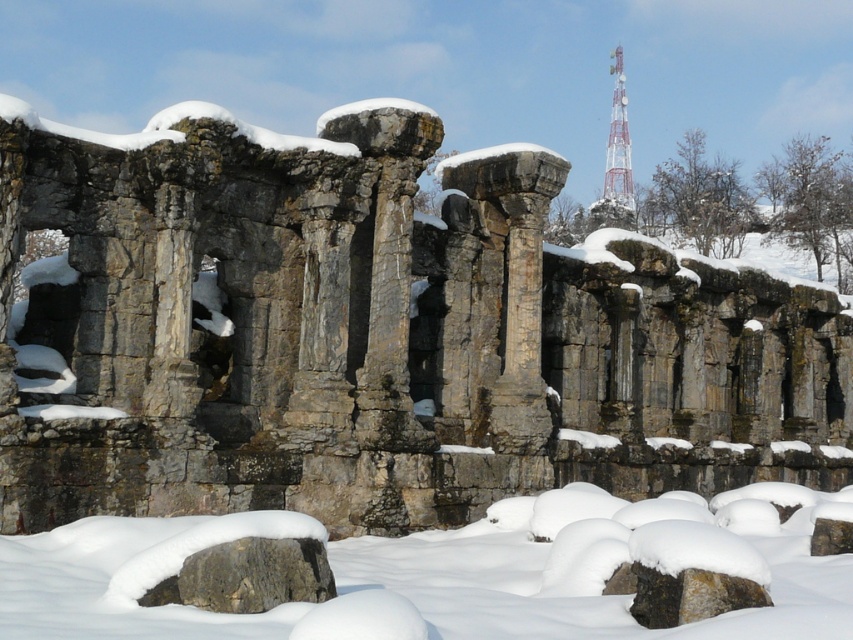
Who is more forward, [498,634] or [612,125]?

Point [498,634] is more forward.

Which is more to the right, white fluffy snow at center or white metallic tower at upper right?

white metallic tower at upper right is more to the right.

Find the location of `white fluffy snow at center`. white fluffy snow at center is located at coordinates (440, 573).

Where is `white fluffy snow at center`? white fluffy snow at center is located at coordinates (440, 573).

Does rusty stone columns at center lie in front of white fluffy snow at center?

No, it is behind white fluffy snow at center.

Can you confirm if rusty stone columns at center is positioned to the right of white fluffy snow at center?

No, rusty stone columns at center is not to the right of white fluffy snow at center.

Which is behind, point (521, 161) or point (527, 518)?

Point (521, 161)

In order to click on rusty stone columns at center in this screenshot , I will do `click(375, 332)`.

Who is more forward, (375,330) or (624,124)?

Point (375,330) is in front.

Which is below, rusty stone columns at center or white metallic tower at upper right?

Positioned lower is rusty stone columns at center.

The height and width of the screenshot is (640, 853). What do you see at coordinates (375, 332) in the screenshot?
I see `rusty stone columns at center` at bounding box center [375, 332].

Where is `rusty stone columns at center`? rusty stone columns at center is located at coordinates (375, 332).